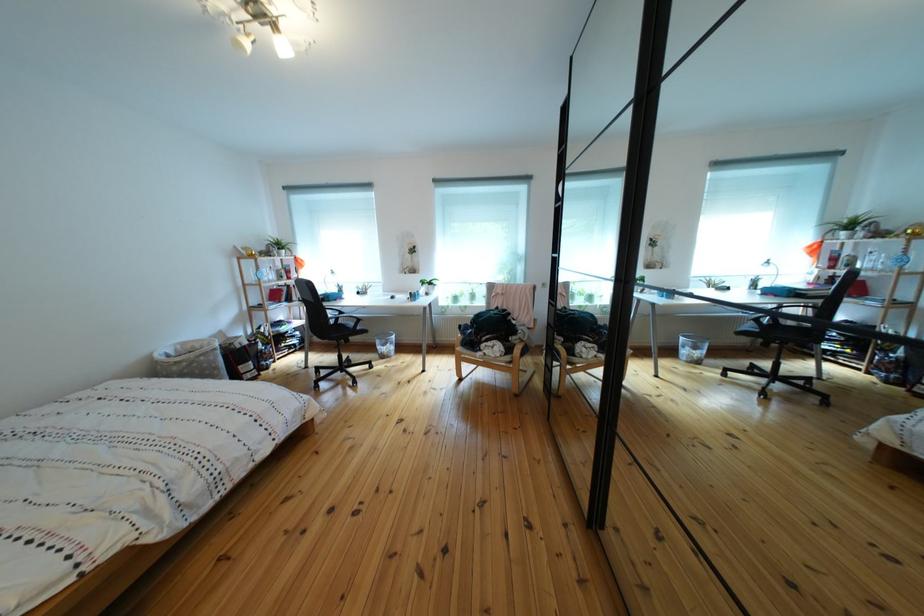
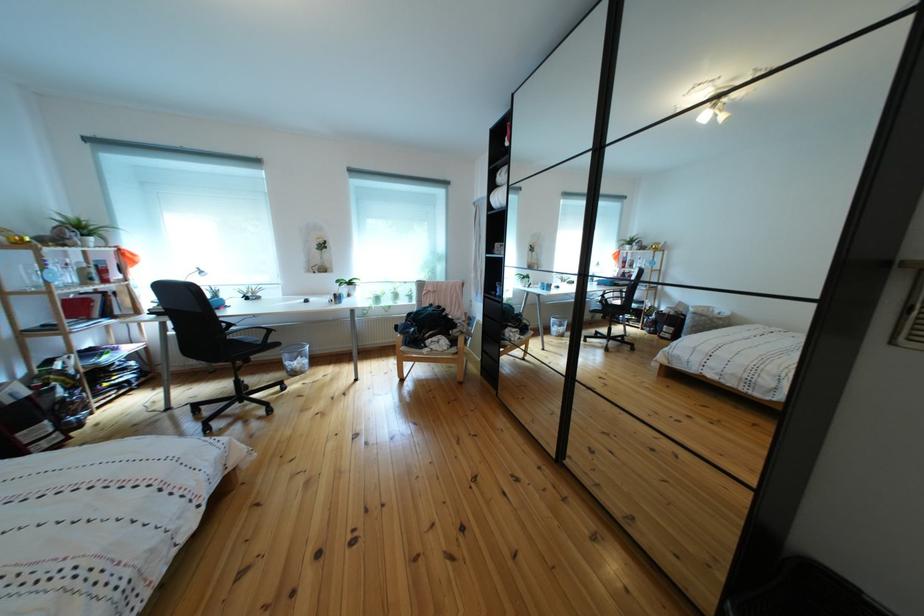
Locate, in the second image, the point that corresponds to point (388, 347) in the first image.

(297, 362)